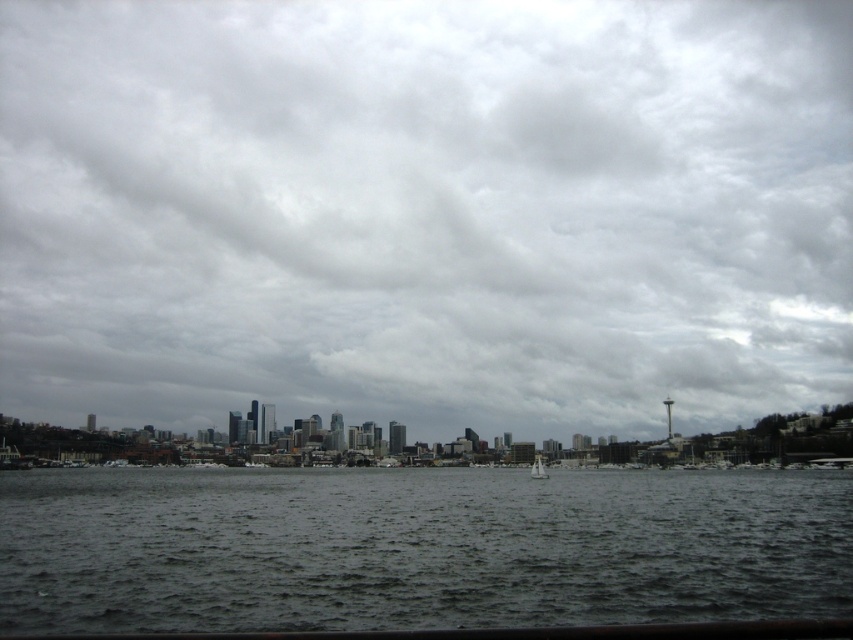
Which is more to the right, cloudy sky at center or dark gray water at center?

dark gray water at center is more to the right.

Is cloudy sky at center wider than dark gray water at center?

Yes.

Locate an element on the screen. The height and width of the screenshot is (640, 853). cloudy sky at center is located at coordinates (425, 211).

Can you confirm if cloudy sky at center is thinner than white plastic sailboat at center?

No.

Which is below, cloudy sky at center or white plastic sailboat at center?

white plastic sailboat at center is below.

Identify the location of cloudy sky at center. This screenshot has width=853, height=640. (425, 211).

Image resolution: width=853 pixels, height=640 pixels. Find the location of `cloudy sky at center`. cloudy sky at center is located at coordinates (425, 211).

Between point (688, 604) and point (538, 474), which one is positioned in front?

Point (688, 604) is in front.

Measure the distance between dark gray water at center and camera.

143.00 feet

At what (x,y) coordinates should I click in order to perform the action: click on dark gray water at center. Please return your answer as a coordinate pair (x, y). This screenshot has height=640, width=853. Looking at the image, I should click on (416, 547).